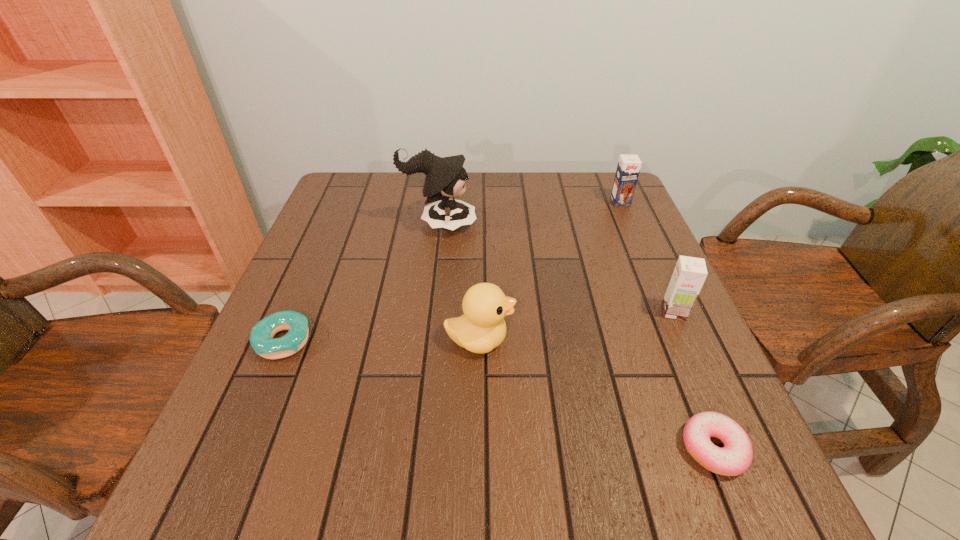
Where is `vacant space that's between the left doughnut and the duck`? The width and height of the screenshot is (960, 540). vacant space that's between the left doughnut and the duck is located at coordinates (381, 340).

At what (x,y) coordinates should I click in order to perform the action: click on free spot between the second farthest object and the nearer doughnut. Please return your answer as a coordinate pair (x, y). Looking at the image, I should click on (576, 336).

You are a GUI agent. You are given a task and a screenshot of the screen. Output one action in this format:
    pyautogui.click(x=<x>, y=<y>)
    Task: Click on the unoccupied position between the farther doughnut and the duck
    
    Given the screenshot: What is the action you would take?
    pyautogui.click(x=381, y=340)

At what (x,y) coordinates should I click in order to perform the action: click on empty space between the farther chocolate milk and the leftmost object. Please return your answer as a coordinate pair (x, y). The height and width of the screenshot is (540, 960). Looking at the image, I should click on (452, 271).

The image size is (960, 540). What are the coordinates of `vacant area that lies between the duck and the nearest object` in the screenshot? It's located at (596, 394).

The image size is (960, 540). What are the coordinates of `free space between the farther doughnut and the duck` in the screenshot? It's located at (381, 340).

Where is `object that is the second closest to the duck`? The image size is (960, 540). object that is the second closest to the duck is located at coordinates (445, 179).

The width and height of the screenshot is (960, 540). I want to click on the closest object to the leftmost object, so click(481, 328).

This screenshot has width=960, height=540. Find the location of `free space in the image that satisfies the following two spatial constraints: 1. on the front label of the farthest object; 2. at the face of the second farthest object`. free space in the image that satisfies the following two spatial constraints: 1. on the front label of the farthest object; 2. at the face of the second farthest object is located at coordinates (x=631, y=224).

Find the location of a particular element. free space that satisfies the following two spatial constraints: 1. on the front label of the farthest object; 2. at the face of the doll is located at coordinates (631, 224).